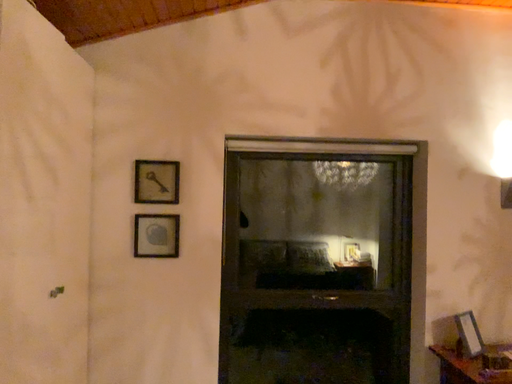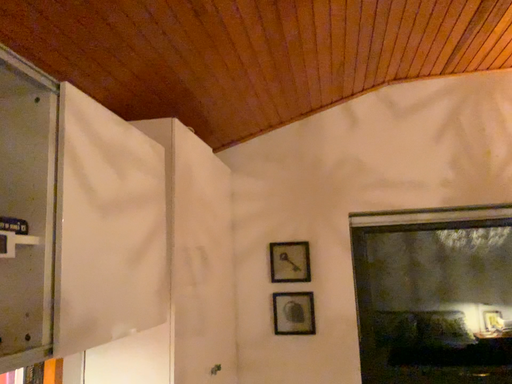
Question: How did the camera likely rotate when shooting the video?

Choices:
 (A) rotated upward
 (B) rotated downward

Answer: (A)